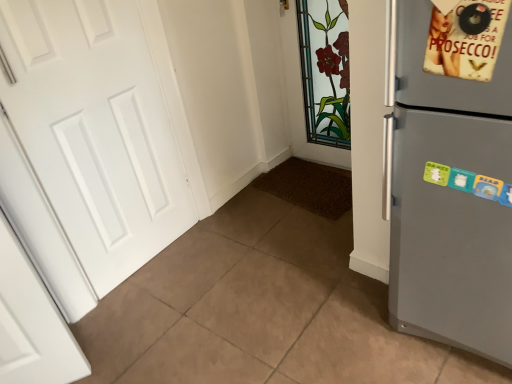
Question: Is satin grey fridge at right completely or partially inside beige paper poster at upper right?

Choices:
 (A) no
 (B) yes

Answer: (A)

Question: Considering the relative positions of beige paper poster at upper right and satin grey fridge at right in the image provided, is beige paper poster at upper right in front of satin grey fridge at right?

Choices:
 (A) yes
 (B) no

Answer: (B)

Question: Is beige paper poster at upper right oriented towards satin grey fridge at right?

Choices:
 (A) no
 (B) yes

Answer: (B)

Question: Are beige paper poster at upper right and satin grey fridge at right making contact?

Choices:
 (A) no
 (B) yes

Answer: (A)

Question: Can you confirm if beige paper poster at upper right is smaller than satin grey fridge at right?

Choices:
 (A) no
 (B) yes

Answer: (B)

Question: Does beige paper poster at upper right have a greater height compared to satin grey fridge at right?

Choices:
 (A) no
 (B) yes

Answer: (A)

Question: Considering the relative sizes of white matte door at left and beige paper poster at upper right in the image provided, is white matte door at left smaller than beige paper poster at upper right?

Choices:
 (A) no
 (B) yes

Answer: (A)

Question: From a real-world perspective, is white matte door at left positioned under beige paper poster at upper right based on gravity?

Choices:
 (A) no
 (B) yes

Answer: (B)

Question: Is white matte door at left turned away from beige paper poster at upper right?

Choices:
 (A) yes
 (B) no

Answer: (B)

Question: Is white matte door at left aimed at beige paper poster at upper right?

Choices:
 (A) yes
 (B) no

Answer: (A)

Question: Can you confirm if white matte door at left is thinner than beige paper poster at upper right?

Choices:
 (A) yes
 (B) no

Answer: (A)

Question: Is beige paper poster at upper right located within white matte door at left?

Choices:
 (A) yes
 (B) no

Answer: (B)

Question: From a real-world perspective, is beige paper poster at upper right beneath white matte door at left?

Choices:
 (A) no
 (B) yes

Answer: (A)